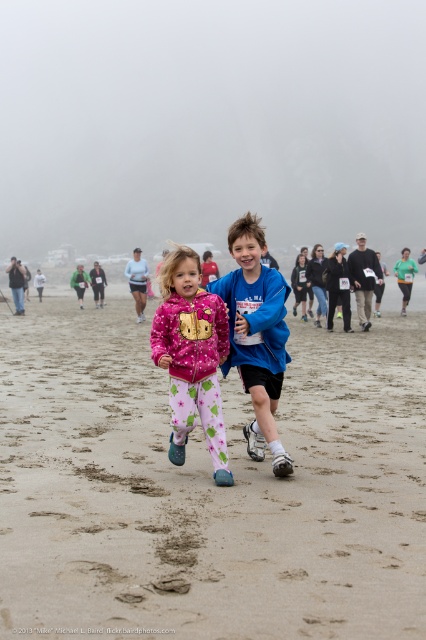
You are a photographer trying to capture a photo of the blue fleece jacket at center from above. Based on the scene, is the sandy beach at center an obstacle in your shot?

The sandy beach at center is below the blue fleece jacket at center, so it will not block the view of the jacket from above. You can capture the photo without the sandy beach at center obstructing the blue fleece jacket at center.

You are standing at the point labeled as point (192,356) in the image. What object is directly beneath your feet?

The point (192,356) is on the pink fleece jacket at center, so the object directly beneath your feet is the pink fleece jacket at center.